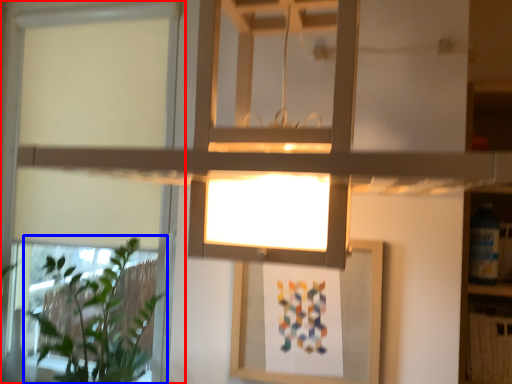
Question: Which point is further to the camera, window (highlighted by a red box) or houseplant (highlighted by a blue box)?

Choices:
 (A) window
 (B) houseplant

Answer: (A)